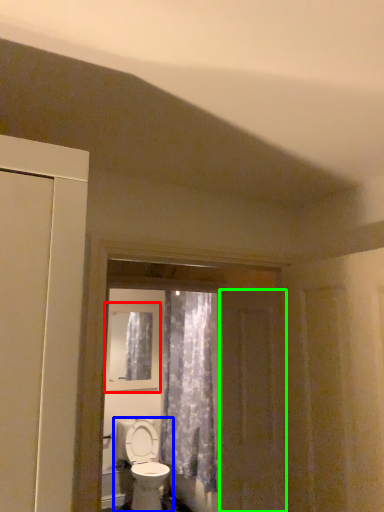
Question: Which object is positioned closest to window (highlighted by a red box)? Select from toilet (highlighted by a blue box) and screen door (highlighted by a green box).

Choices:
 (A) toilet
 (B) screen door

Answer: (A)